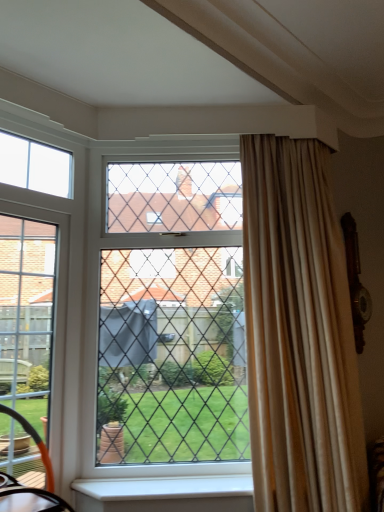
Question: Does beige silk curtain at right have a greater width compared to white smooth window sill at lower center?

Choices:
 (A) no
 (B) yes

Answer: (B)

Question: From a real-world perspective, is beige silk curtain at right under white smooth window sill at lower center?

Choices:
 (A) no
 (B) yes

Answer: (A)

Question: Is beige silk curtain at right to the left of white smooth window sill at lower center from the viewer's perspective?

Choices:
 (A) no
 (B) yes

Answer: (A)

Question: Is beige silk curtain at right bigger than white smooth window sill at lower center?

Choices:
 (A) no
 (B) yes

Answer: (B)

Question: Does beige silk curtain at right come in front of white smooth window sill at lower center?

Choices:
 (A) yes
 (B) no

Answer: (A)

Question: Is white smooth window sill at lower center inside or outside of beige silk curtain at right?

Choices:
 (A) inside
 (B) outside

Answer: (B)

Question: Considering the positions of white smooth window sill at lower center and beige silk curtain at right in the image, is white smooth window sill at lower center wider or thinner than beige silk curtain at right?

Choices:
 (A) thin
 (B) wide

Answer: (A)

Question: From a real-world perspective, relative to beige silk curtain at right, is white smooth window sill at lower center vertically above or below?

Choices:
 (A) below
 (B) above

Answer: (A)

Question: From their relative heights in the image, would you say white smooth window sill at lower center is taller or shorter than beige silk curtain at right?

Choices:
 (A) tall
 (B) short

Answer: (B)

Question: In terms of height, does beige silk curtain at right look taller or shorter compared to white smooth window sill at lower center?

Choices:
 (A) tall
 (B) short

Answer: (A)

Question: From a real-world perspective, is beige silk curtain at right positioned above or below white smooth window sill at lower center?

Choices:
 (A) above
 (B) below

Answer: (A)

Question: Considering the relative positions of beige silk curtain at right and white smooth window sill at lower center in the image provided, is beige silk curtain at right to the left or to the right of white smooth window sill at lower center?

Choices:
 (A) left
 (B) right

Answer: (B)

Question: Is beige silk curtain at right in front of or behind white smooth window sill at lower center in the image?

Choices:
 (A) front
 (B) behind

Answer: (A)

Question: Considering the relative positions of clear glass window at center and beige silk curtain at right in the image provided, is clear glass window at center to the left or to the right of beige silk curtain at right?

Choices:
 (A) left
 (B) right

Answer: (A)

Question: Relative to beige silk curtain at right, is clear glass window at center in front or behind?

Choices:
 (A) behind
 (B) front

Answer: (A)